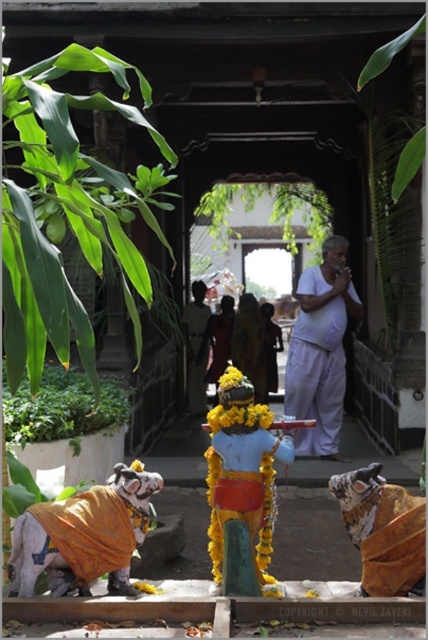
Does yellow fabric tiger at lower right appear over yellow fabric garland at center?

No.

Which is in front, point (412, 589) or point (264, 362)?

Positioned in front is point (412, 589).

Does point (383, 516) come in front of point (262, 349)?

Yes, it is in front of point (262, 349).

The image size is (428, 640). In order to click on yellow fabric tiger at lower right in this screenshot , I will do `click(383, 531)`.

Describe the element at coordinates (383, 531) in the screenshot. The image size is (428, 640). I see `yellow fabric tiger at lower right` at that location.

Image resolution: width=428 pixels, height=640 pixels. I want to click on yellow fabric tiger at lower right, so click(383, 531).

Does point (416, 522) come farther from viewer compared to point (211, 362)?

No, it is not.

Find the location of a particular element. yellow fabric tiger at lower right is located at coordinates (383, 531).

Does yellow fabric clothed dog at lower left have a smaller size compared to yellow fabric tiger at lower right?

Actually, yellow fabric clothed dog at lower left might be larger than yellow fabric tiger at lower right.

The height and width of the screenshot is (640, 428). Find the location of `yellow fabric clothed dog at lower left`. yellow fabric clothed dog at lower left is located at coordinates (83, 536).